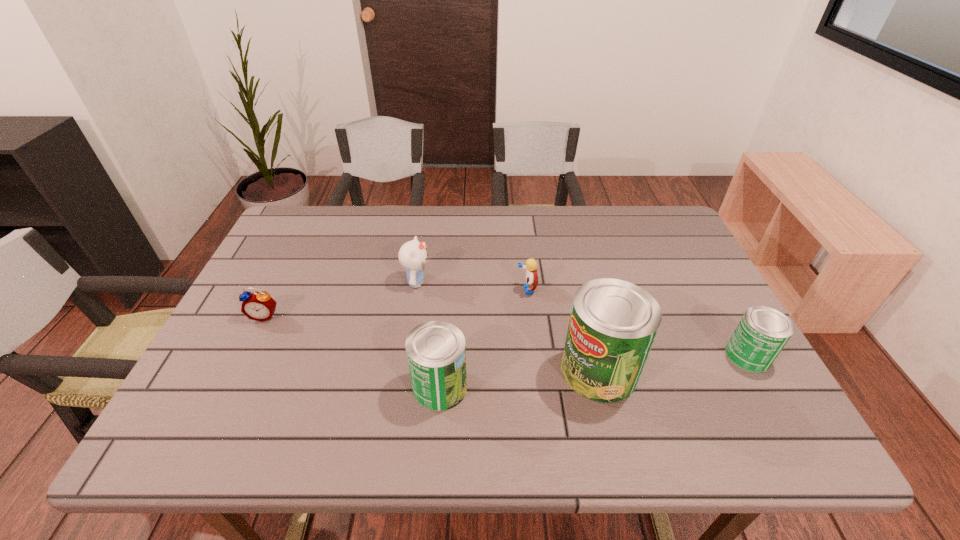
In order to click on free location that satisfies the following two spatial constraints: 1. on the back side of the rightmost object; 2. on the front-facing side of the kitten in this screenshot , I will do `click(707, 282)`.

This screenshot has height=540, width=960. Find the location of `vacant region that satisfies the following two spatial constraints: 1. on the front-facing side of the second object from right to left; 2. on the right side of the alarm clock`. vacant region that satisfies the following two spatial constraints: 1. on the front-facing side of the second object from right to left; 2. on the right side of the alarm clock is located at coordinates (238, 371).

This screenshot has width=960, height=540. I want to click on vacant area that satisfies the following two spatial constraints: 1. on the front-facing side of the kitten; 2. on the right side of the rightmost object, so click(405, 356).

This screenshot has height=540, width=960. Identify the location of free space that satisfies the following two spatial constraints: 1. on the front-facing side of the third farthest object; 2. on the right side of the leftmost can. (229, 387).